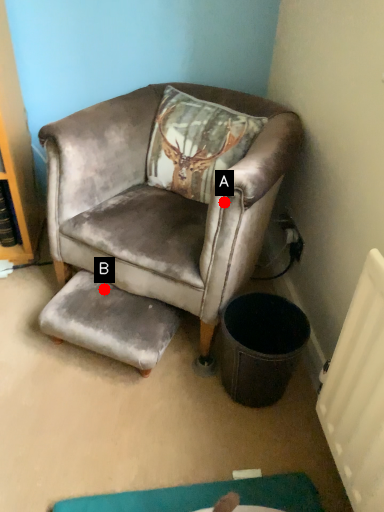
Question: Two points are circled on the image, labeled by A and B beside each circle. Which of the following is the farthest from the observer?

Choices:
 (A) A is further
 (B) B is further

Answer: (B)